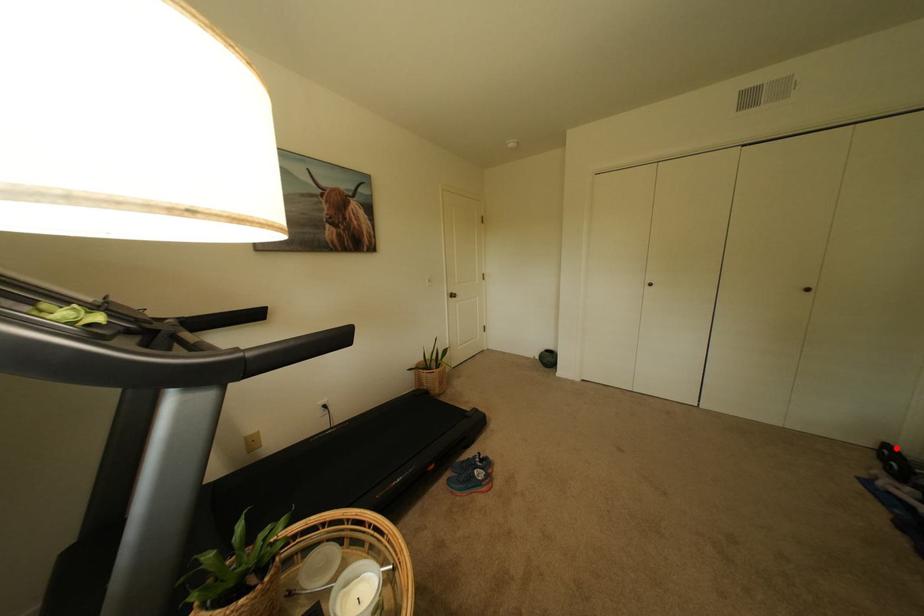
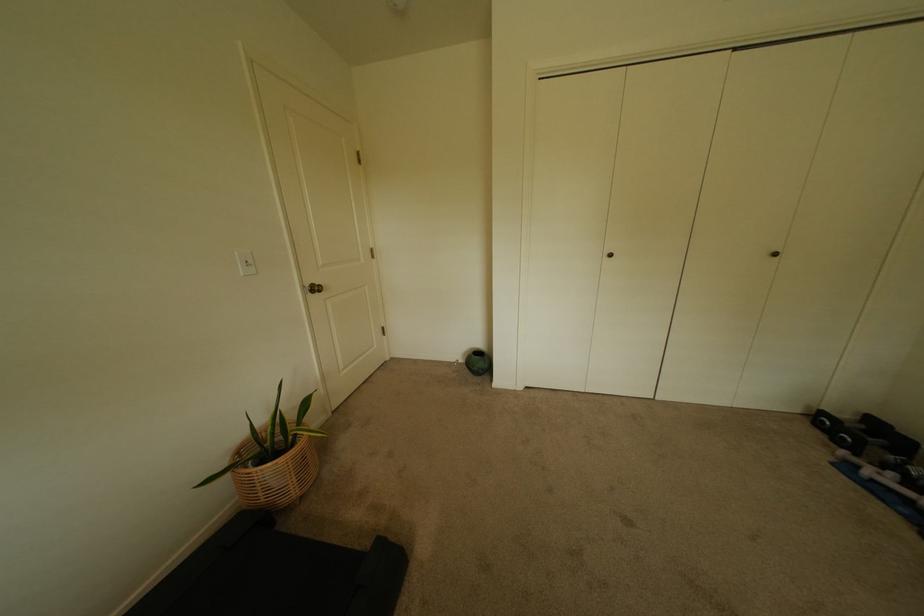
Question: A red point is marked in image1. In image2, is the corresponding 3D point closer to the camera or farther? Reply with the corresponding letter.

Choices:
 (A) The corresponding 3D point is closer.
 (B) The corresponding 3D point is farther.

Answer: (A)